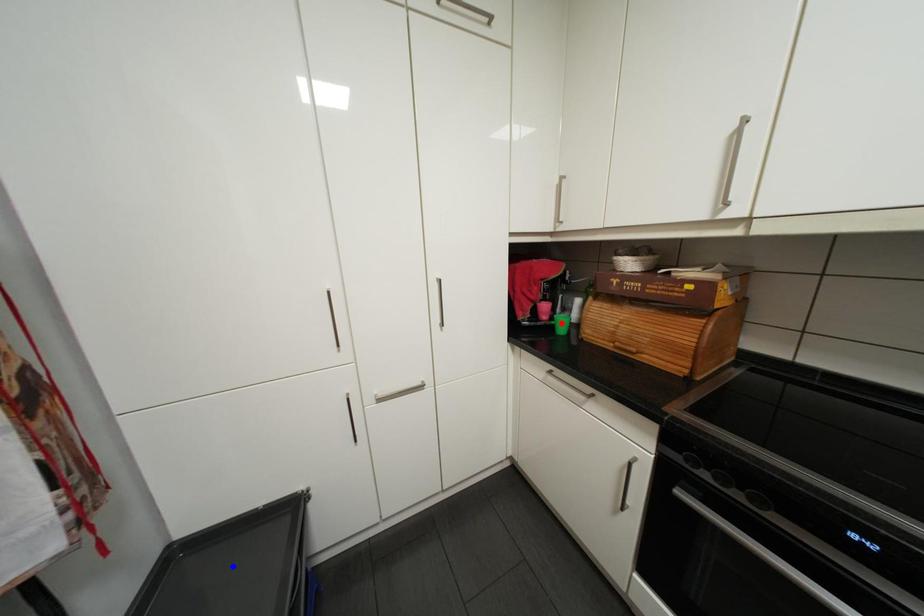
Question: Which of the two points in the image is closer to the camera?

Choices:
 (A) Blue point is closer.
 (B) Red point is closer.

Answer: (A)